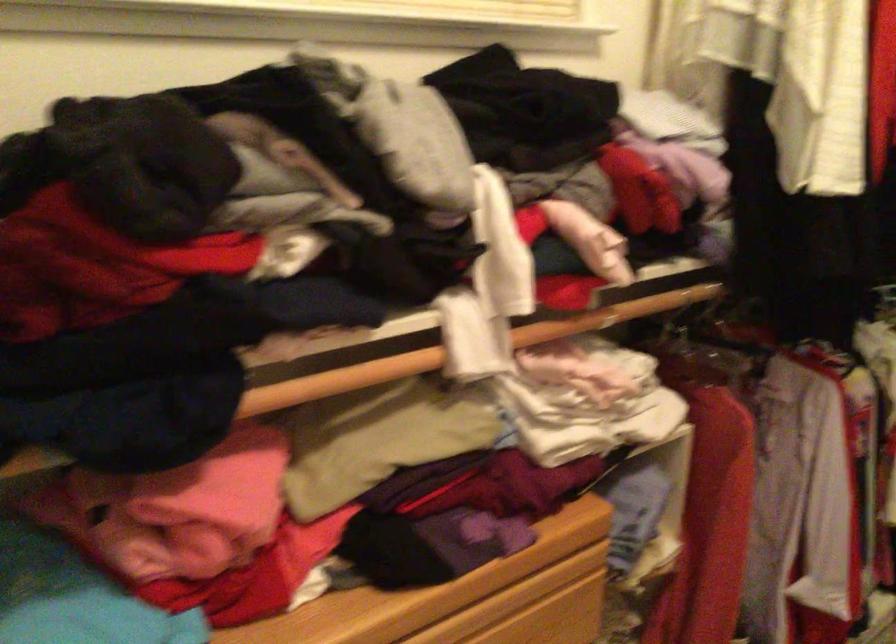
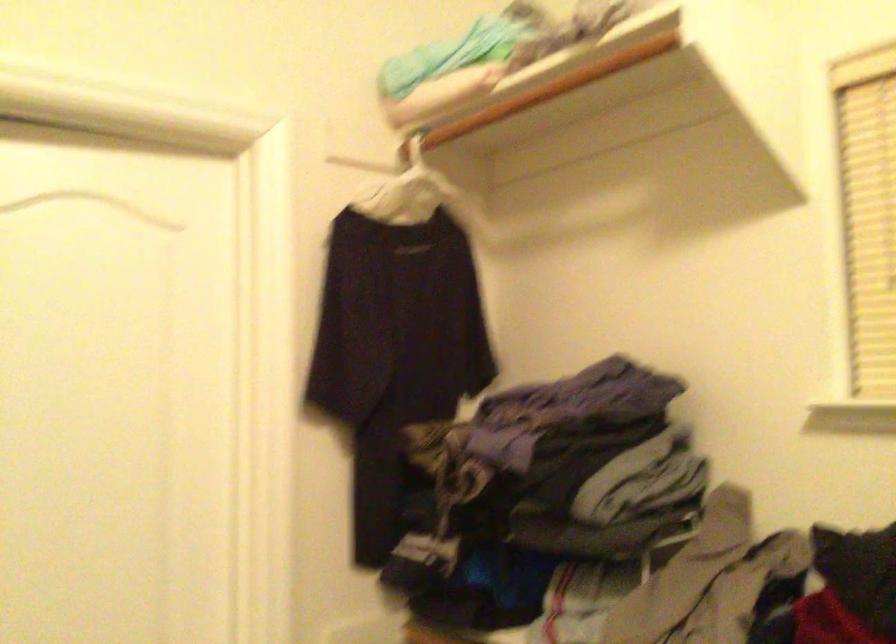
Question: The camera is either moving clockwise (left) or counter-clockwise (right) around the object. The first image is from the beginning of the video and the second image is from the end. Is the camera moving left or right when shooting the video?

Choices:
 (A) Left
 (B) Right

Answer: (B)